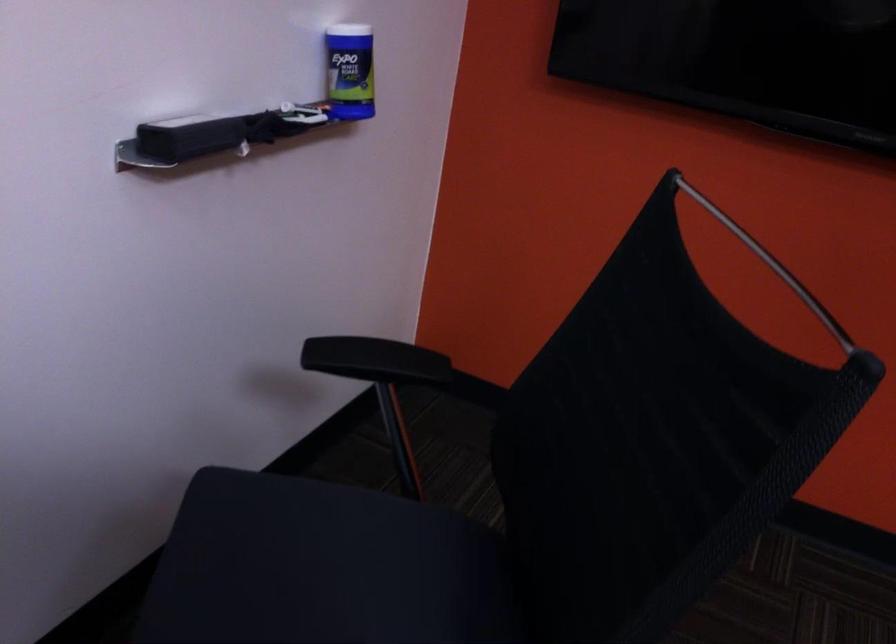
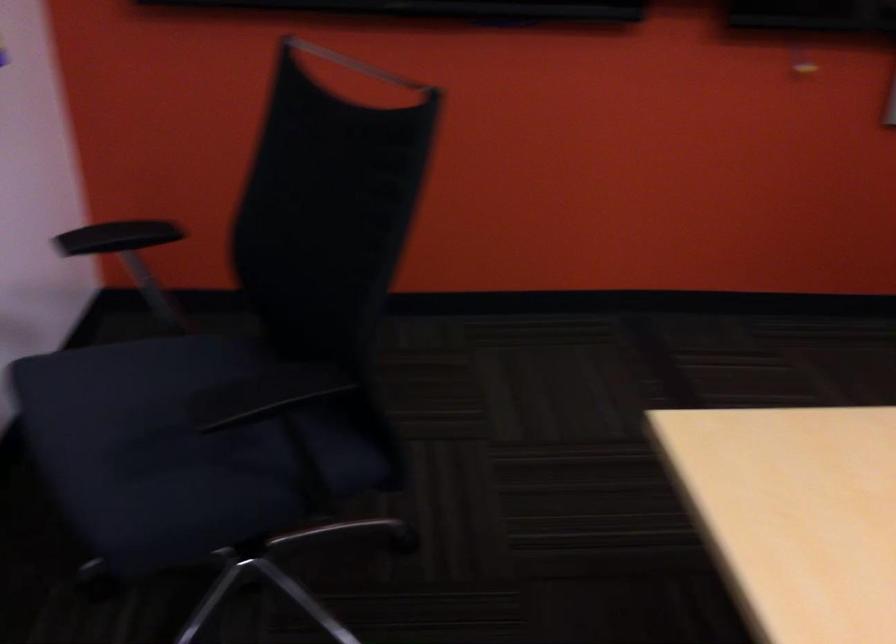
Where in the second image is the point corresponding to the point at 363,357 from the first image?

(117, 237)